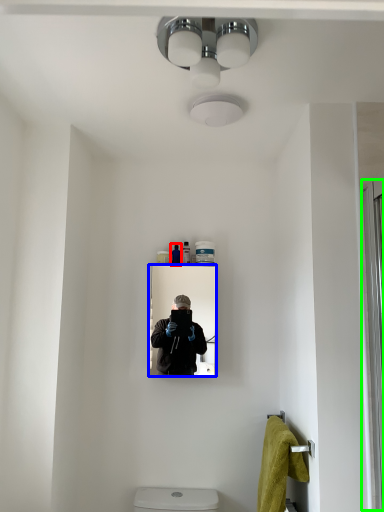
Question: Estimate the real-world distances between objects in this image. Which object is farther from toiletry (highlighted by a red box), mirror (highlighted by a blue box) or screen door (highlighted by a green box)?

Choices:
 (A) mirror
 (B) screen door

Answer: (B)